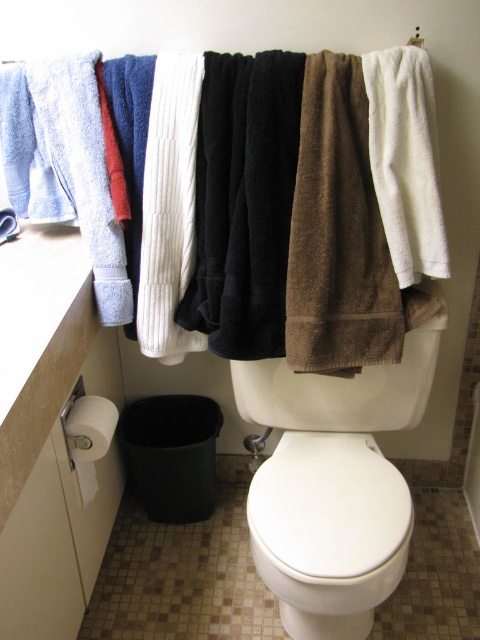
You are standing in the bathroom scene described. There is a point at coordinate (334, 484). What object is located at this point?

The white glossy toilet bowl at center is located at point (334, 484).

You are standing in the bathroom and want to place a new decorative item exactly at the point marked as point (328, 506). What object is currently occupying that location?

The white glossy toilet lid at center is located at point (328, 506), so that location is currently occupied by the white glossy toilet lid at center.